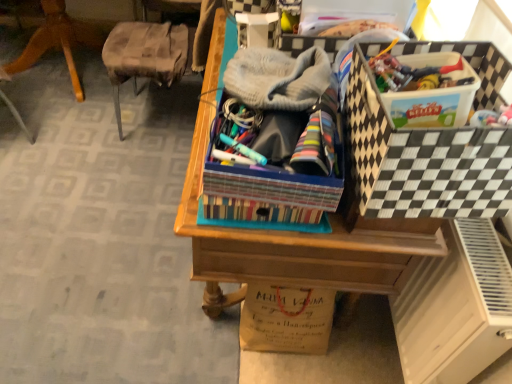
Question: Does brown paper bag at lower center have a greater width compared to wooden desk at center?

Choices:
 (A) no
 (B) yes

Answer: (A)

Question: Considering the relative sizes of brown paper bag at lower center and wooden desk at center in the image provided, is brown paper bag at lower center taller than wooden desk at center?

Choices:
 (A) yes
 (B) no

Answer: (B)

Question: From a real-world perspective, is brown paper bag at lower center located higher than wooden desk at center?

Choices:
 (A) no
 (B) yes

Answer: (A)

Question: From the image's perspective, is brown paper bag at lower center beneath wooden desk at center?

Choices:
 (A) no
 (B) yes

Answer: (B)

Question: Are brown paper bag at lower center and wooden desk at center making contact?

Choices:
 (A) no
 (B) yes

Answer: (A)

Question: From the image's perspective, is brown paper bag at lower center above wooden desk at center?

Choices:
 (A) no
 (B) yes

Answer: (A)

Question: From a real-world perspective, is black and white checkered storage box at upper right located higher than gray knitted hat at center?

Choices:
 (A) no
 (B) yes

Answer: (A)

Question: Does black and white checkered storage box at upper right have a larger size compared to gray knitted hat at center?

Choices:
 (A) yes
 (B) no

Answer: (A)

Question: Considering the relative sizes of black and white checkered storage box at upper right and gray knitted hat at center in the image provided, is black and white checkered storage box at upper right wider than gray knitted hat at center?

Choices:
 (A) no
 (B) yes

Answer: (B)

Question: Are black and white checkered storage box at upper right and gray knitted hat at center located far from each other?

Choices:
 (A) yes
 (B) no

Answer: (B)

Question: From the image's perspective, is black and white checkered storage box at upper right above gray knitted hat at center?

Choices:
 (A) no
 (B) yes

Answer: (A)

Question: Could you tell me if black and white checkered storage box at upper right is facing gray knitted hat at center?

Choices:
 (A) no
 (B) yes

Answer: (B)

Question: Considering the relative sizes of white matte file cabinet at lower right and wooden chair at left in the image provided, is white matte file cabinet at lower right shorter than wooden chair at left?

Choices:
 (A) no
 (B) yes

Answer: (B)